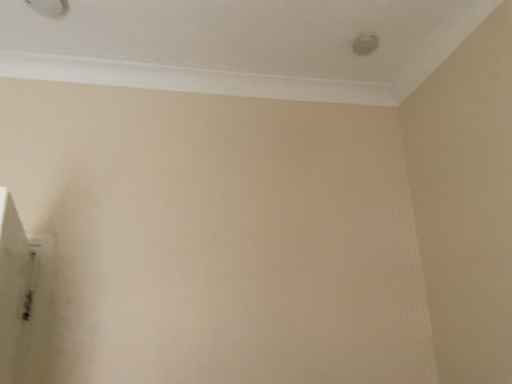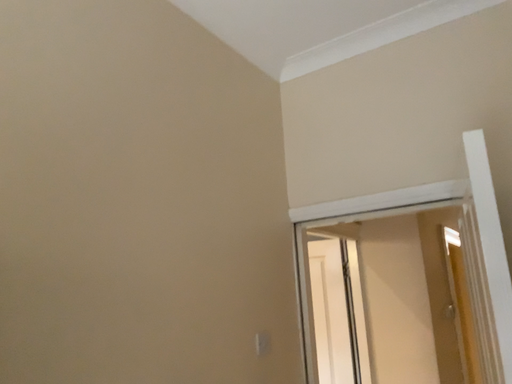
Question: Which way did the camera rotate in the video?

Choices:
 (A) rotated downward
 (B) rotated upward

Answer: (A)